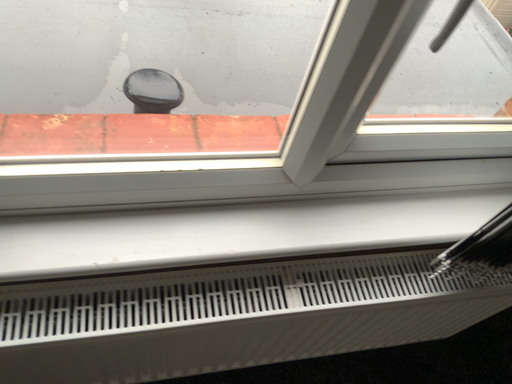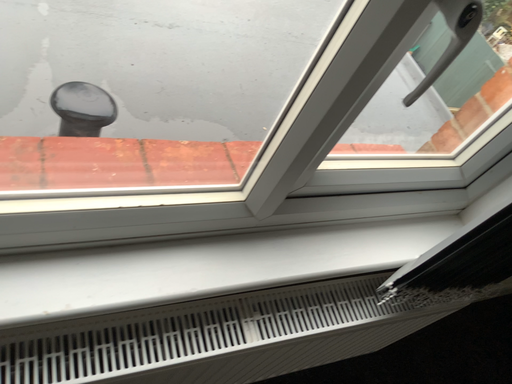
Question: Which way did the camera rotate in the video?

Choices:
 (A) rotated left
 (B) rotated right

Answer: (B)